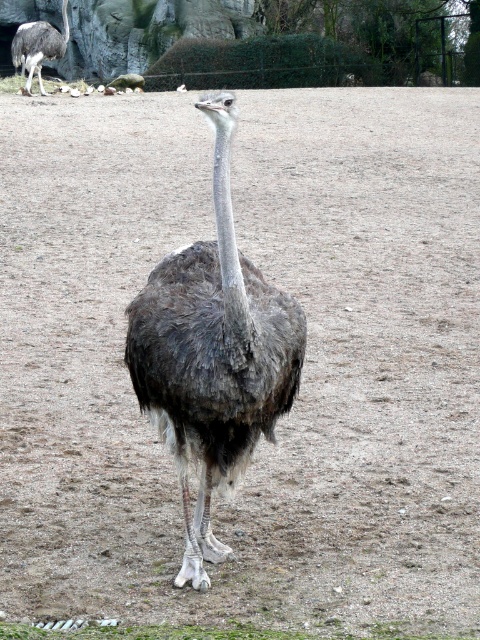
How much distance is there between dark gray feathers at center and dark gray feathers at upper left?

dark gray feathers at center is 24.30 meters from dark gray feathers at upper left.

Between dark gray feathers at center and dark gray feathers at upper left, which one is positioned lower?

Positioned lower is dark gray feathers at center.

Does point (203, 513) come behind point (27, 26)?

No.

Identify the location of dark gray feathers at center. This screenshot has height=640, width=480. (213, 355).